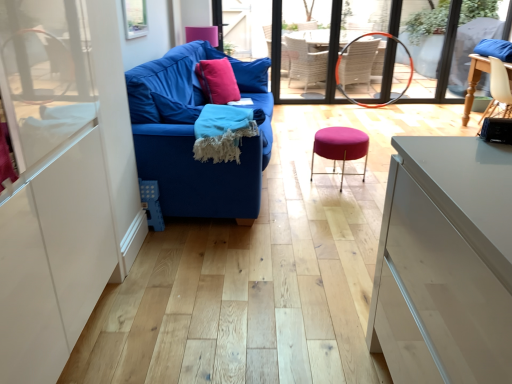
Measure the distance between teal woven blanket at center and camera.

The distance of teal woven blanket at center from camera is 2.38 meters.

Measure the distance between pink fabric pillow at center and camera.

pink fabric pillow at center is 4.07 meters from camera.

The width and height of the screenshot is (512, 384). Describe the element at coordinates (244, 71) in the screenshot. I see `pink fabric pillow at center` at that location.

What do you see at coordinates (217, 81) in the screenshot?
I see `matte pink throw pillow at center` at bounding box center [217, 81].

Locate an element on the screen. This screenshot has height=384, width=512. purple fabric stool at center is located at coordinates (340, 147).

Image resolution: width=512 pixels, height=384 pixels. What do you see at coordinates (359, 35) in the screenshot?
I see `orange rubber hula hoop at center` at bounding box center [359, 35].

This screenshot has width=512, height=384. Identify the location of matte wicker armchair at center. (341, 60).

Identify the location of teal woven blanket at center. This screenshot has height=384, width=512. (222, 132).

Does point (486, 11) come farther from viewer compared to point (239, 110)?

Yes, it is.

From a real-world perspective, is orange rubber hula hoop at center positioned over teal woven blanket at center based on gravity?

Correct, in the physical world, orange rubber hula hoop at center is higher than teal woven blanket at center.

Consider the image. Who is smaller, orange rubber hula hoop at center or teal woven blanket at center?

Smaller between the two is teal woven blanket at center.

Between orange rubber hula hoop at center and teal woven blanket at center, which one is positioned in front?

teal woven blanket at center is more forward.

Is purple fabric stool at center positioned far away from matte wicker armchair at center?

Yes, purple fabric stool at center is far from matte wicker armchair at center.

Does point (345, 132) come closer to viewer compared to point (412, 58)?

Yes, it is in front of point (412, 58).

Considering the relative sizes of purple fabric stool at center and matte wicker armchair at center in the image provided, is purple fabric stool at center taller than matte wicker armchair at center?

Incorrect, the height of purple fabric stool at center is not larger of that of matte wicker armchair at center.

Identify the location of throw pillow on the left of pink fabric pillow at center. (217, 81).

Is pink fabric pillow at center far from matte pink throw pillow at center?

No, pink fabric pillow at center is not far away from matte pink throw pillow at center.

Between pink fabric pillow at center and matte pink throw pillow at center, which one is positioned behind?

pink fabric pillow at center is further from the camera.

Between pink fabric pillow at center and matte pink throw pillow at center, which one has smaller width?

matte pink throw pillow at center.

Which of these two, wooden chair at right or pink fabric pillow at center, stands shorter?

Standing shorter between the two is pink fabric pillow at center.

Which object is more forward, wooden chair at right or pink fabric pillow at center?

wooden chair at right is in front.

Could you tell me if wooden chair at right is facing pink fabric pillow at center?

No, wooden chair at right is not facing towards pink fabric pillow at center.

Is wooden chair at right not near pink fabric pillow at center?

Absolutely, wooden chair at right is distant from pink fabric pillow at center.

Locate an element on the screen. The height and width of the screenshot is (384, 512). window screen on the right of pink fabric pillow at center is located at coordinates (359, 35).

From a real-world perspective, which is physically below, orange rubber hula hoop at center or pink fabric pillow at center?

orange rubber hula hoop at center, from a real-world perspective.

From the image's perspective, who appears lower, orange rubber hula hoop at center or pink fabric pillow at center?

pink fabric pillow at center.

Is orange rubber hula hoop at center not near pink fabric pillow at center?

Indeed, orange rubber hula hoop at center is not near pink fabric pillow at center.

Is wooden chair at right wider or thinner than blue fabric couch at left?

wooden chair at right is thinner than blue fabric couch at left.

The image size is (512, 384). I want to click on studio couch that is above the wooden chair at right (from a real-world perspective), so click(193, 135).

Is wooden chair at right next to blue fabric couch at left?

There is a gap between wooden chair at right and blue fabric couch at left.

From the image's perspective, is wooden chair at right over blue fabric couch at left?

Correct, wooden chair at right appears higher than blue fabric couch at left in the image.

From the image's perspective, is pink fabric pillow at center under blue fabric couch at left?

No.

Which of these two, pink fabric pillow at center or blue fabric couch at left, stands shorter?

pink fabric pillow at center is shorter.

Is pink fabric pillow at center touching blue fabric couch at left?

Answer: pink fabric pillow at center and blue fabric couch at left are clearly separated.

Considering the relative sizes of pink fabric pillow at center and blue fabric couch at left in the image provided, is pink fabric pillow at center thinner than blue fabric couch at left?

Yes, pink fabric pillow at center is thinner than blue fabric couch at left.

The width and height of the screenshot is (512, 384). Find the location of `material in front of the orange rubber hula hoop at center`. material in front of the orange rubber hula hoop at center is located at coordinates (222, 132).

The height and width of the screenshot is (384, 512). I want to click on armchair on the right of purple fabric stool at center, so click(x=341, y=60).

Considering their positions, is pink fabric pillow at center positioned further to teal woven blanket at center than matte pink throw pillow at center?

Based on the image, pink fabric pillow at center appears to be further to teal woven blanket at center.

Based on their spatial positions, is pink fabric pillow at center or purple fabric stool at center further from wooden chair at right?

Based on the image, pink fabric pillow at center appears to be further to wooden chair at right.

From the image, which object appears to be nearer to pink fabric pillow at center, matte pink throw pillow at center or teal woven blanket at center?

matte pink throw pillow at center is positioned closer to the anchor pink fabric pillow at center.

Consider the image. Considering their positions, is blue fabric couch at left positioned further to matte pink throw pillow at center than matte wicker armchair at center?

matte wicker armchair at center is further to matte pink throw pillow at center.

From the image, which object appears to be nearer to blue fabric couch at left, wooden chair at right or teal woven blanket at center?

teal woven blanket at center lies closer to blue fabric couch at left than the other object.

Looking at the image, which one is located further to blue fabric couch at left, teal woven blanket at center or orange rubber hula hoop at center?

orange rubber hula hoop at center is further to blue fabric couch at left.

Estimate the real-world distances between objects in this image. Which object is further from pink fabric pillow at center, purple fabric stool at center or blue fabric couch at left?

purple fabric stool at center is further to pink fabric pillow at center.

Which object lies nearer to the anchor point blue fabric couch at left, purple fabric stool at center or wooden chair at right?

The object closer to blue fabric couch at left is purple fabric stool at center.

Locate an element on the screen. material positioned between blue fabric couch at left and matte wicker armchair at center from near to far is located at coordinates (222, 132).

Find the location of a particular element. The height and width of the screenshot is (384, 512). armchair between matte pink throw pillow at center and wooden chair at right in the horizontal direction is located at coordinates (341, 60).

This screenshot has height=384, width=512. In order to click on chair between teal woven blanket at center and matte wicker armchair at center along the z-axis in this screenshot , I will do `click(498, 91)`.

Identify the location of pillow between teal woven blanket at center and orange rubber hula hoop at center in the front-back direction. This screenshot has height=384, width=512. (244, 71).